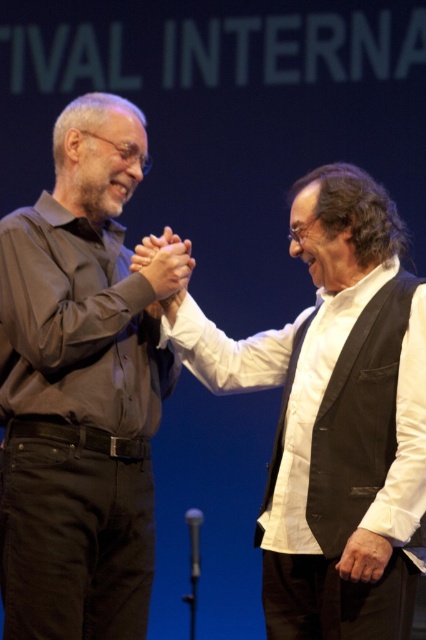
You are designing a stage backdrop and need to ensure that the white shirt at center and the matte brown hands at center are visible. Based on their sizes, which one should you focus on making larger in the design to maintain visibility?

The white shirt at center might be wider than matte brown hands at center, so to maintain visibility, focus on making the white shirt at center larger in the design.

You are a photographer standing behind the two individuals on stage. You want to take a photo that includes both the white shirt at center and the matte brown hands at center. The camera you are using has a minimum focus distance of 20 inches. Will you be able to focus on both subjects clearly in the same photo?

The distance between the white shirt at center and the matte brown hands at center is 19.87 inches, which is less than the camera minimum focus distance of 20 inches. Therefore, the camera cannot focus on both subjects clearly in the same photo.

Consider the image. You are designing a stage backdrop and need to place a banner between the matte black shirt at left and the matte brown hands at center. The banner must be positioned so that it doesn

The matte black shirt at left is larger than the matte brown hands at center. Therefore, the banner should be placed closer to the matte brown hands at center to balance the visual weight between the two objects.